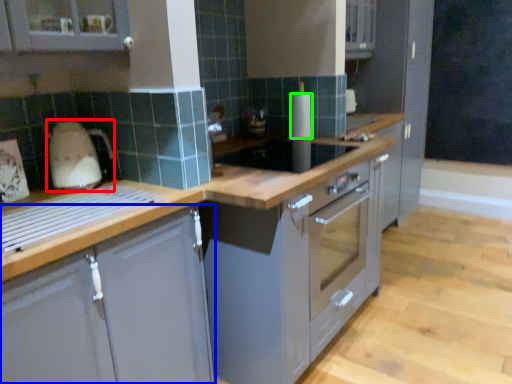
Question: Which object is positioned closest to home appliance (highlighted by a red box)? Select from cabinetry (highlighted by a blue box) and kitchen appliance (highlighted by a green box).

Choices:
 (A) cabinetry
 (B) kitchen appliance

Answer: (A)